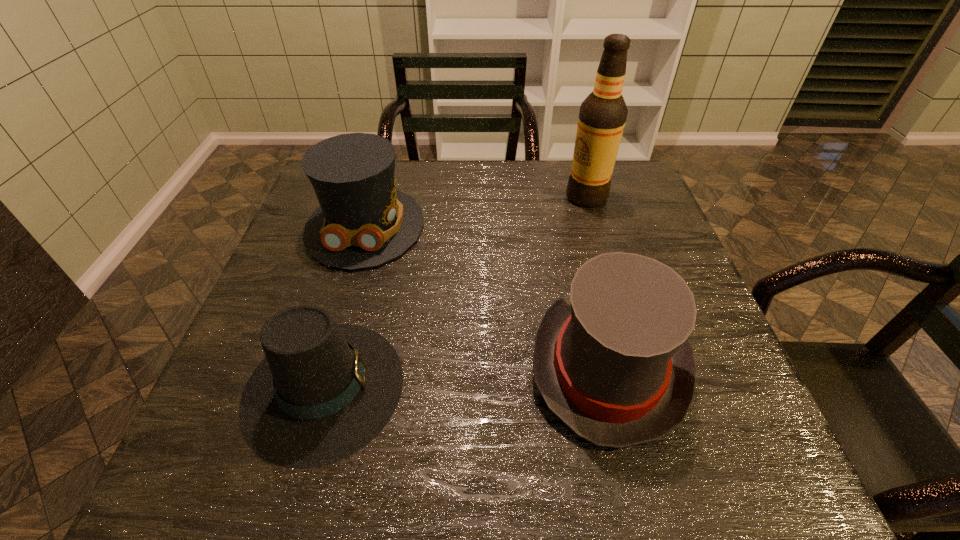
Locate an element on the screen. blank space at the near left corner is located at coordinates (227, 448).

At what (x,y) coordinates should I click in order to perform the action: click on free space at the near right corner of the desktop. Please return your answer as a coordinate pair (x, y). Looking at the image, I should click on (746, 464).

Where is `free space that is in between the farthest hat and the tallest object`? free space that is in between the farthest hat and the tallest object is located at coordinates (476, 212).

The width and height of the screenshot is (960, 540). I want to click on free space between the rightmost hat and the farthest hat, so click(487, 296).

In order to click on vacant region between the tallest object and the farthest hat in this screenshot , I will do click(x=476, y=212).

The width and height of the screenshot is (960, 540). In order to click on vacant region between the alcohol and the farthest hat in this screenshot , I will do `click(476, 212)`.

This screenshot has height=540, width=960. I want to click on vacant region between the tallest object and the farthest hat, so tap(476, 212).

The image size is (960, 540). In order to click on vacant space that's between the farthest hat and the alcohol in this screenshot , I will do `click(476, 212)`.

Find the location of a particular element. object that is the second nearest to the rightmost hat is located at coordinates (363, 221).

The width and height of the screenshot is (960, 540). In order to click on object that stands as the second closest to the farthest hat in this screenshot , I will do `click(612, 361)`.